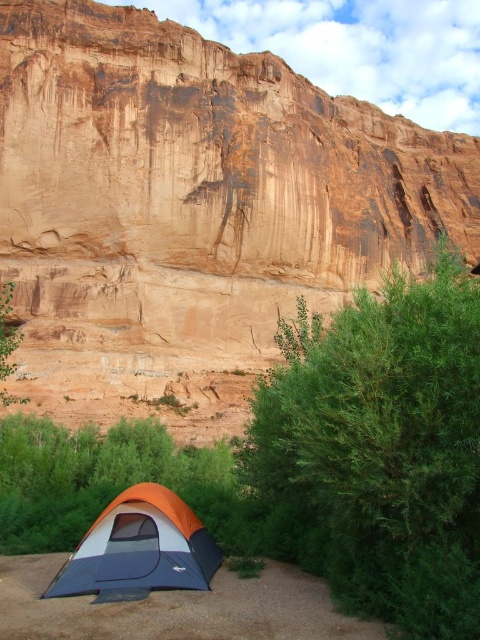
Question: Among these points, which one is nearest to the camera?

Choices:
 (A) (277, 529)
 (B) (95, 522)
 (C) (1, 289)

Answer: (A)

Question: Is matte sandstone cliff at upper center to the left of green leafy tree at lower left from the viewer's perspective?

Choices:
 (A) yes
 (B) no

Answer: (B)

Question: Is orange fabric tent at lower left bigger than green leafy tree at lower left?

Choices:
 (A) yes
 (B) no

Answer: (B)

Question: Based on their relative distances, which object is nearer to the green leafy bush at lower right?

Choices:
 (A) matte sandstone cliff at upper center
 (B) green leafy tree at lower left
 (C) orange fabric tent at lower left

Answer: (C)

Question: Which object appears closest to the camera in this image?

Choices:
 (A) green leafy tree at lower left
 (B) matte sandstone cliff at upper center
 (C) green leafy bush at lower right
 (D) orange fabric tent at lower left

Answer: (C)

Question: From the image, what is the correct spatial relationship of green leafy bush at lower right in relation to orange fabric tent at lower left?

Choices:
 (A) right
 (B) left

Answer: (A)